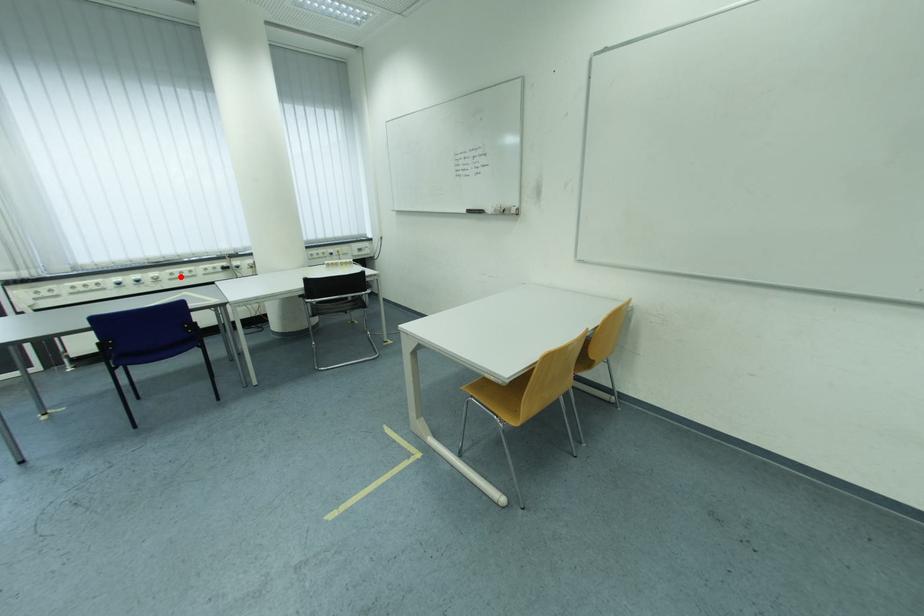
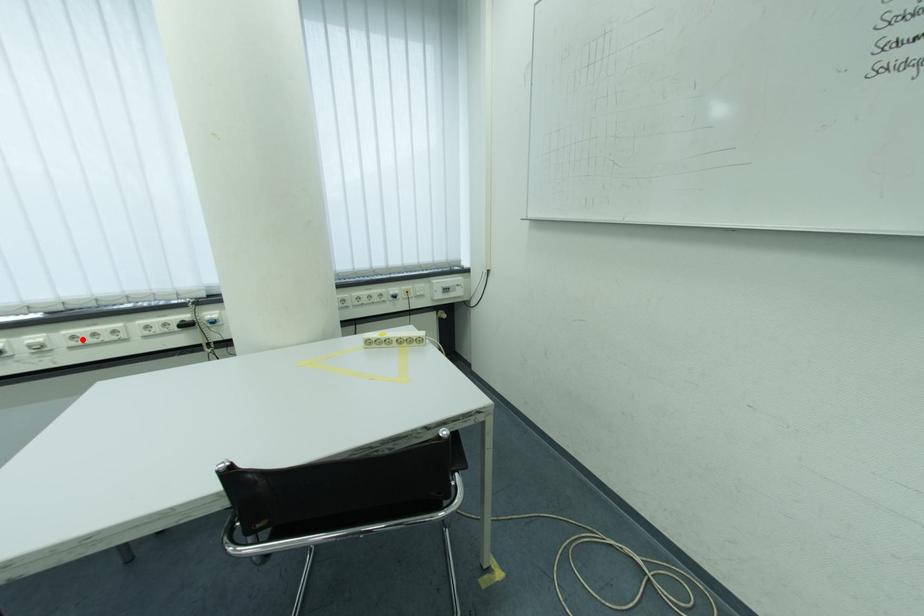
I am providing you with two images of the same scene from different viewpoints. A red point is marked on the first image and another point is marked on the second image. Do the highlighted points in image1 and image2 indicate the same real-world spot?

Yes